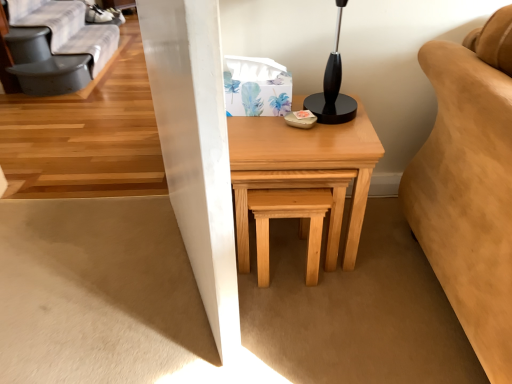
Question: Is natural wood table at center positioned behind natural wood stool at center?

Choices:
 (A) no
 (B) yes

Answer: (A)

Question: Does natural wood table at center have a lesser width compared to natural wood stool at center?

Choices:
 (A) no
 (B) yes

Answer: (A)

Question: Can you confirm if natural wood table at center is shorter than natural wood stool at center?

Choices:
 (A) no
 (B) yes

Answer: (A)

Question: Is natural wood table at center at the right side of natural wood stool at center?

Choices:
 (A) yes
 (B) no

Answer: (A)

Question: From a real-world perspective, is natural wood table at center positioned under natural wood stool at center based on gravity?

Choices:
 (A) no
 (B) yes

Answer: (A)

Question: Based on their sizes in the image, would you say natural wood stool at center is bigger or smaller than natural wood table at center?

Choices:
 (A) small
 (B) big

Answer: (A)

Question: From the image's perspective, is natural wood stool at center located above or below natural wood table at center?

Choices:
 (A) above
 (B) below

Answer: (B)

Question: In terms of height, does natural wood stool at center look taller or shorter compared to natural wood table at center?

Choices:
 (A) tall
 (B) short

Answer: (B)

Question: Is natural wood stool at center to the left or to the right of natural wood table at center in the image?

Choices:
 (A) left
 (B) right

Answer: (A)

Question: In terms of width, does natural wood stool at center look wider or thinner when compared to gray fabric futon at upper left?

Choices:
 (A) thin
 (B) wide

Answer: (A)

Question: Considering the positions of natural wood stool at center and gray fabric futon at upper left in the image, is natural wood stool at center taller or shorter than gray fabric futon at upper left?

Choices:
 (A) short
 (B) tall

Answer: (B)

Question: From the image's perspective, relative to gray fabric futon at upper left, is natural wood stool at center above or below?

Choices:
 (A) below
 (B) above

Answer: (A)

Question: Which is correct: natural wood stool at center is inside gray fabric futon at upper left, or outside of it?

Choices:
 (A) inside
 (B) outside

Answer: (B)

Question: Based on their sizes in the image, would you say natural wood table at center is bigger or smaller than natural wood stool at center?

Choices:
 (A) big
 (B) small

Answer: (A)

Question: Looking at their shapes, would you say natural wood table at center is wider or thinner than natural wood stool at center?

Choices:
 (A) wide
 (B) thin

Answer: (A)